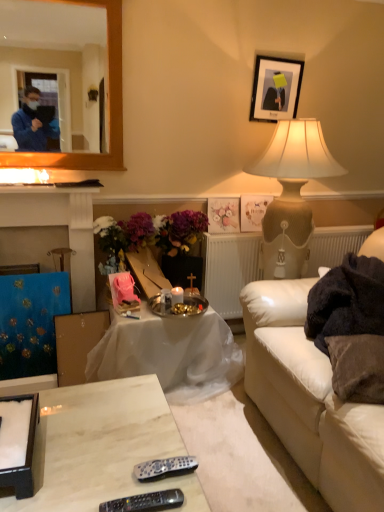
Question: Considering the positions of white textured radiator at center and white paper picture frame at upper center, the second picture frame in the bottom-to-top sequence, in the image, is white textured radiator at center bigger or smaller than white paper picture frame at upper center, the second picture frame in the bottom-to-top sequence,?

Choices:
 (A) big
 (B) small

Answer: (A)

Question: From a real-world perspective, is white textured radiator at center above or below white paper picture frame at upper center, the second picture frame in the bottom-to-top sequence?

Choices:
 (A) above
 (B) below

Answer: (B)

Question: Based on their relative distances, which object is farther from the white leather couch at lower right?

Choices:
 (A) matte black picture frame at upper center, which is counted as the 3th picture frame, starting from the bottom
 (B) marble remote control at lower center, the first table when ordered from front to back
 (C) brown fuzzy pillow at lower right
 (D) white textured radiator at center
 (E) white cloth-covered table at center, marked as the second table in a front-to-back arrangement

Answer: (A)

Question: Based on their relative distances, which object is farther from the white cloth-covered table at center, marked as the second table in a front-to-back arrangement?

Choices:
 (A) blue fabric curtain at left
 (B) matte floral picture frame at center, marked as the 1th picture frame in a bottom-to-top arrangement
 (C) white leather couch at lower right
 (D) marble remote control at lower center, the 2th table from the back
 (E) silver metallic remote at lower center, which ranks as the second remote in front-to-back order

Answer: (E)